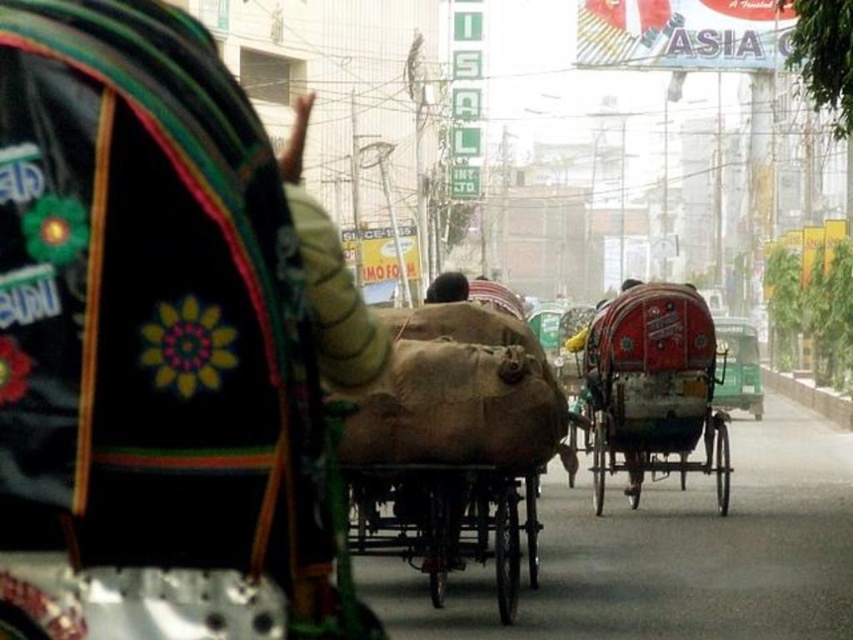
Question: Is red painted wood rickshaw at center positioned before brown fabric bag at center?

Choices:
 (A) no
 (B) yes

Answer: (A)

Question: Does red painted wood rickshaw at center appear over brown fabric cart at center?

Choices:
 (A) no
 (B) yes

Answer: (B)

Question: Among these points, which one is nearest to the camera?

Choices:
 (A) (509, 524)
 (B) (624, 310)
 (C) (444, 272)

Answer: (A)

Question: Is red painted wood rickshaw at center further to the viewer compared to brown fabric bag at center?

Choices:
 (A) no
 (B) yes

Answer: (B)

Question: Which point is farther to the camera?

Choices:
 (A) (434, 301)
 (B) (532, 563)
 (C) (666, 355)

Answer: (C)

Question: Estimate the real-world distances between objects in this image. Which object is farther from the brown fabric cart at center?

Choices:
 (A) red painted wood rickshaw at center
 (B) brown fabric bag at center

Answer: (A)